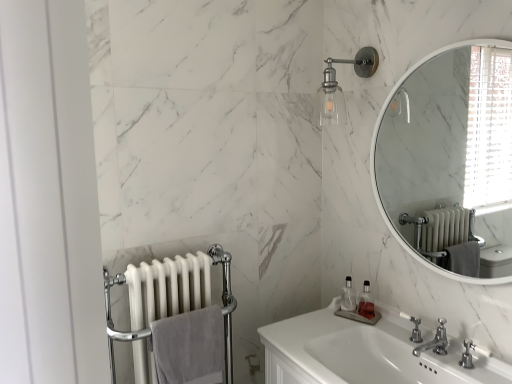
Identify the location of free spot to the left of white plastic faucet at lower right, the first plumbing fixture positioned from the back. (379, 336).